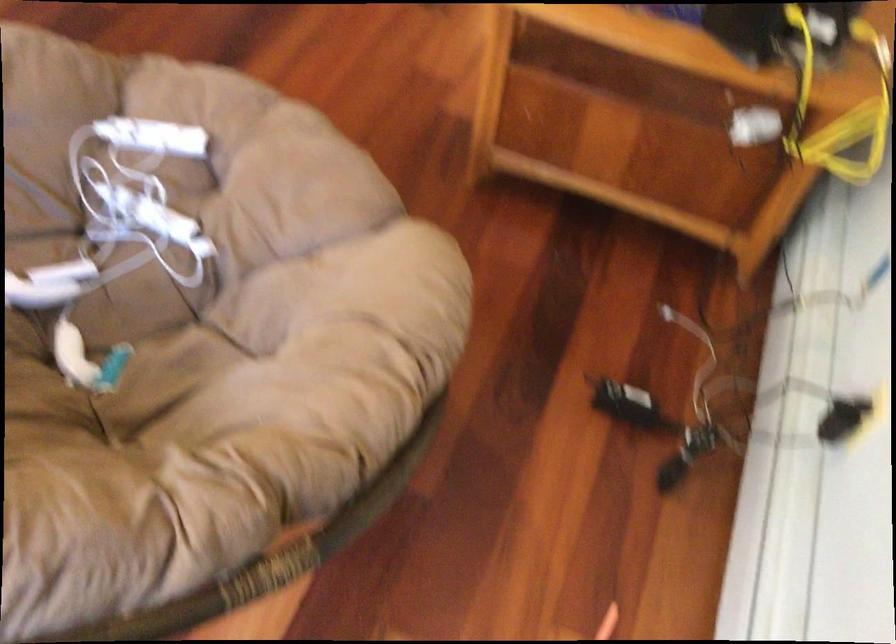
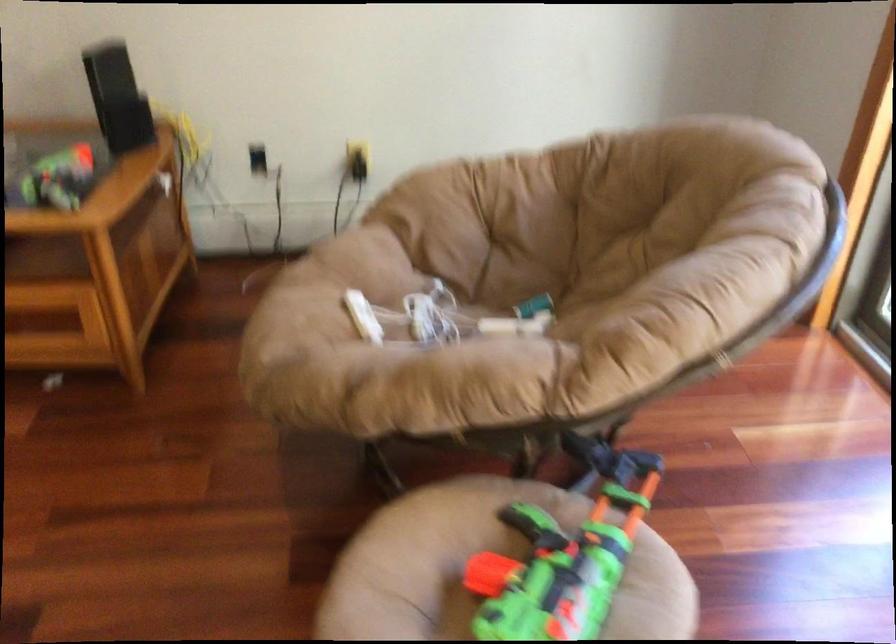
Find the pixel in the second image that matches the point at 134,236 in the first image.

(442, 317)